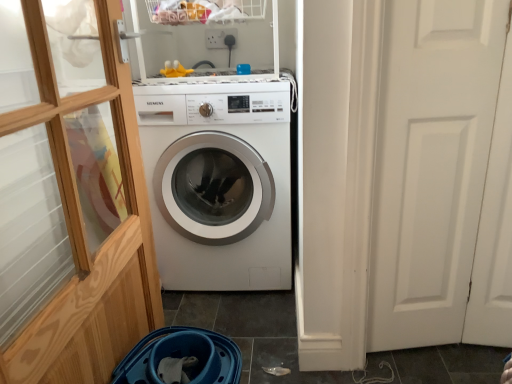
Question: Is transparent wood glass door at left to the left or to the right of white matte door at right in the image?

Choices:
 (A) right
 (B) left

Answer: (B)

Question: Which is correct: transparent wood glass door at left is inside white matte door at right, or outside of it?

Choices:
 (A) outside
 (B) inside

Answer: (A)

Question: Which of these objects is positioned farthest from the transparent wood glass door at left?

Choices:
 (A) white matte door at right
 (B) white glossy washing machine at center
 (C) white plastic shelf at upper center

Answer: (A)

Question: Estimate the real-world distances between objects in this image. Which object is farther from the white plastic shelf at upper center?

Choices:
 (A) white glossy washing machine at center
 (B) white matte door at right
 (C) transparent wood glass door at left

Answer: (B)